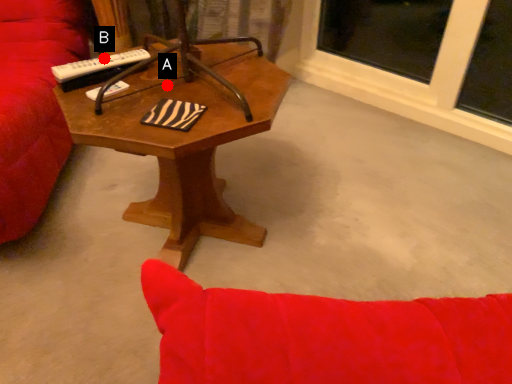
Question: Two points are circled on the image, labeled by A and B beside each circle. Which point is closer to the camera?

Choices:
 (A) A is closer
 (B) B is closer

Answer: (B)